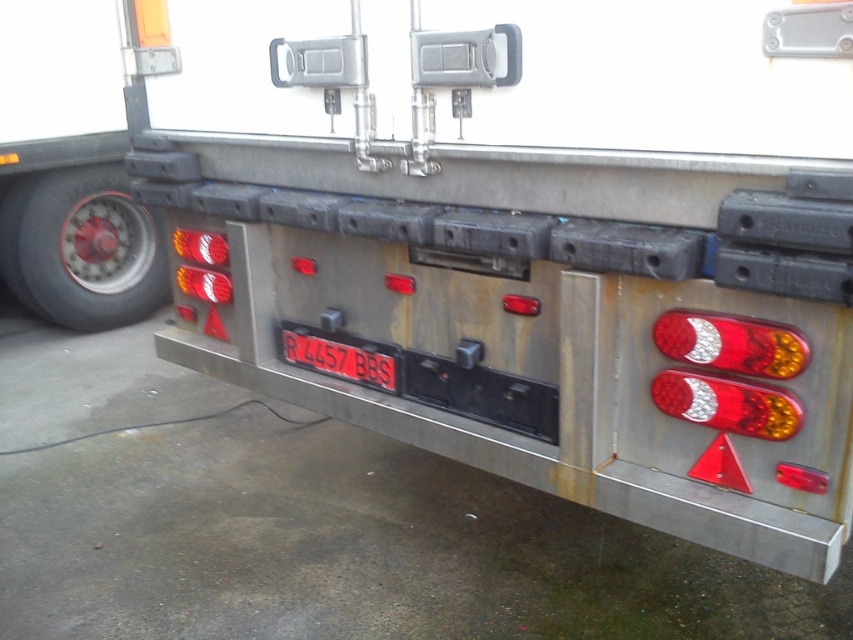
Question: Which of the following is the closest to the observer?

Choices:
 (A) (283, 332)
 (B) (694, 324)
 (C) (788, 433)

Answer: (C)

Question: Which point is closer to the camera taking this photo?

Choices:
 (A) (718, 332)
 (B) (374, 364)

Answer: (A)

Question: From the image, what is the correct spatial relationship of matte plastic brake light at right in relation to black plastic license plate at center?

Choices:
 (A) right
 (B) left

Answer: (A)

Question: Which of the following is the farthest from the observer?

Choices:
 (A) translucent plastic brake light at right
 (B) black plastic license plate at center

Answer: (B)

Question: Does translucent plastic brake light at right appear over black plastic license plate at center?

Choices:
 (A) no
 (B) yes

Answer: (A)

Question: In this image, where is translucent plastic brake light at right located relative to black plastic license plate at center?

Choices:
 (A) above
 (B) below

Answer: (B)